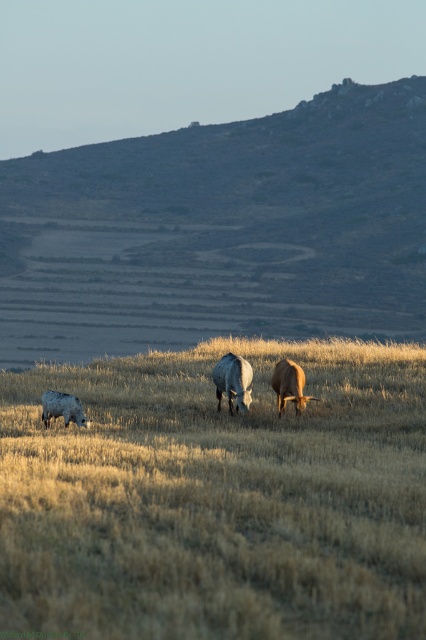
Can you confirm if dry grass at center is positioned above white woolly sheep at lower left?

Yes, dry grass at center is above white woolly sheep at lower left.

This screenshot has width=426, height=640. Identify the location of dry grass at center. (218, 499).

Image resolution: width=426 pixels, height=640 pixels. What do you see at coordinates (218, 499) in the screenshot? I see `dry grass at center` at bounding box center [218, 499].

At what (x,y) coordinates should I click in order to perform the action: click on dry grass at center. Please return your answer as a coordinate pair (x, y). The image size is (426, 640). Looking at the image, I should click on (218, 499).

Who is more distant from viewer, (219,369) or (74,400)?

The point (219,369) is more distant.

What do you see at coordinates (233, 381) in the screenshot?
I see `shiny brown cow at center` at bounding box center [233, 381].

At what (x,y) coordinates should I click in order to perform the action: click on shiny brown cow at center. Please return your answer as a coordinate pair (x, y). Looking at the image, I should click on (233, 381).

Locate an element on the screen. The width and height of the screenshot is (426, 640). shiny brown cow at center is located at coordinates (233, 381).

Measure the distance from dry grass at center to brown matte cow at center.

A distance of 2.83 meters exists between dry grass at center and brown matte cow at center.

Which is behind, point (189, 381) or point (284, 358)?

Positioned behind is point (189, 381).

Identify the location of dry grass at center. This screenshot has width=426, height=640. (218, 499).